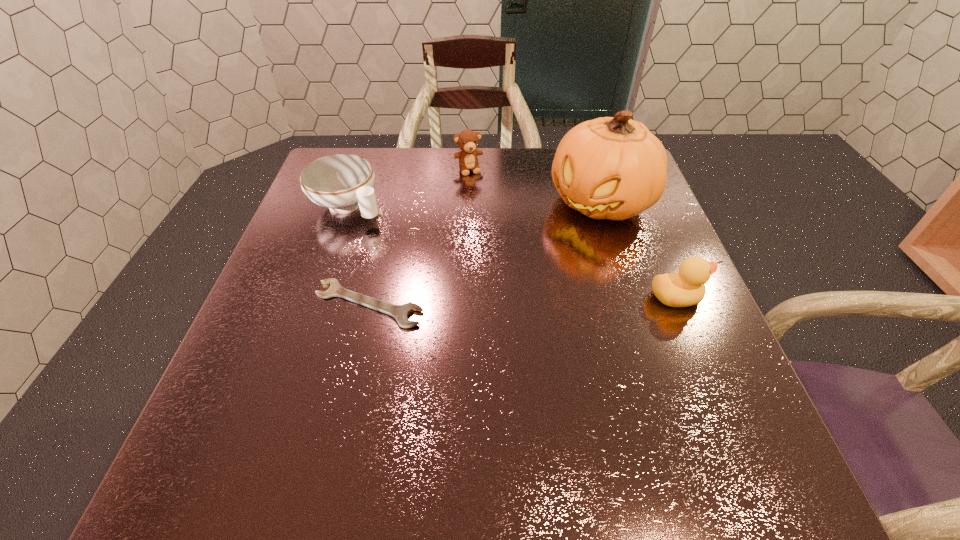
The height and width of the screenshot is (540, 960). What are the coordinates of `wrench` in the screenshot? It's located at (400, 312).

I want to click on duckling, so click(x=686, y=288).

Locate an element on the screen. chinaware is located at coordinates (342, 182).

Where is `pumpkin`? Image resolution: width=960 pixels, height=540 pixels. pumpkin is located at coordinates (614, 168).

At what (x,y) coordinates should I click in order to perform the action: click on teddy bear. Please return your answer as a coordinate pair (x, y). Looking at the image, I should click on (467, 140).

At what (x,y) coordinates should I click in order to perform the action: click on vacant space located on the back of the shortest object. Please return your answer as a coordinate pair (x, y). Looking at the image, I should click on (389, 217).

Image resolution: width=960 pixels, height=540 pixels. What are the coordinates of `vacant space situated 0.180m on the side with the handle of the chinaware` in the screenshot? It's located at (418, 255).

I want to click on vacant space located on the side with the handle of the chinaware, so click(x=438, y=271).

Where is `free region located 0.090m on the side with the handle of the chinaware`? The width and height of the screenshot is (960, 540). free region located 0.090m on the side with the handle of the chinaware is located at coordinates (393, 238).

The width and height of the screenshot is (960, 540). Identify the location of free region located on the front face of the pumpkin. (562, 239).